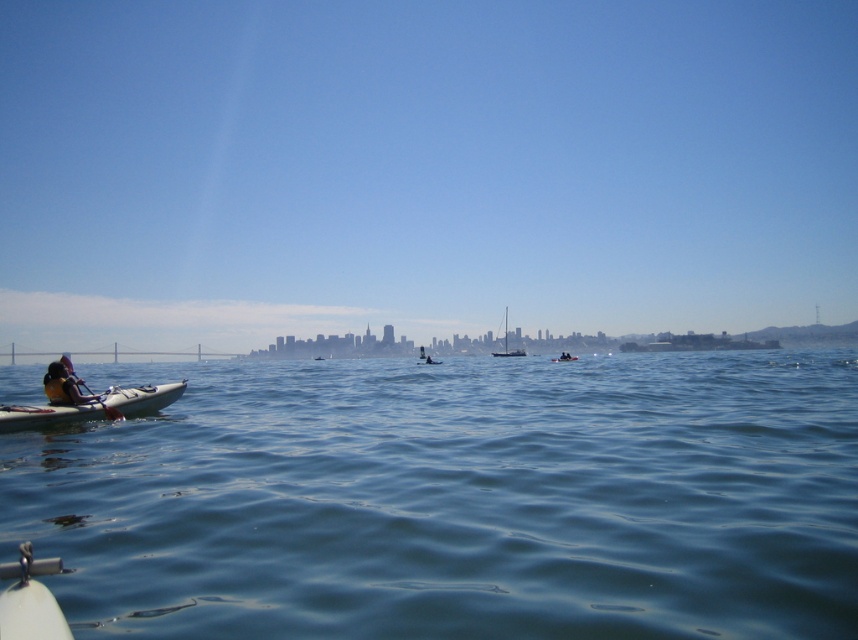
You are a photographer trying to capture a shot of the city skyline. You notice two points in your viewfinder at coordinates point (x=505, y=355) and point (x=493, y=355). Which point will appear larger in your photo?

Point (x=505, y=355) is closer to the camera than point (x=493, y=355), so it will appear larger in the photo.